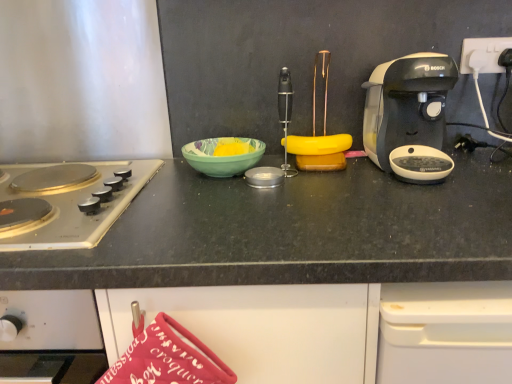
Question: From the image's perspective, is green glossy bowl at center located above or below white plastic power outlet at upper right?

Choices:
 (A) above
 (B) below

Answer: (B)

Question: From their relative heights in the image, would you say green glossy bowl at center is taller or shorter than white plastic power outlet at upper right?

Choices:
 (A) short
 (B) tall

Answer: (A)

Question: Which is farther from the green glossy bowl at center?

Choices:
 (A) black plastic coffee maker at right
 (B) silver/golden metallic gas stove at left
 (C) white plastic power outlet at upper right

Answer: (C)

Question: Which is farther from the black plastic coffee maker at right?

Choices:
 (A) silver/golden metallic gas stove at left
 (B) white plastic power outlet at upper right
 (C) green glossy bowl at center

Answer: (A)